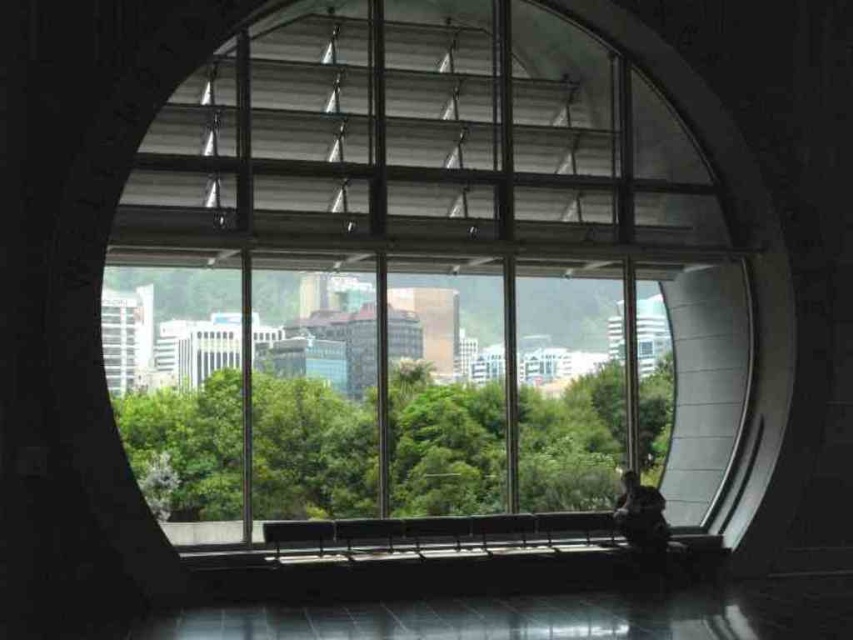
Question: Which of the following is the closest to the observer?

Choices:
 (A) transparent glass window at center
 (B) green leafy tree at center

Answer: (A)

Question: Is transparent glass window at center smaller than green leafy tree at center?

Choices:
 (A) no
 (B) yes

Answer: (A)

Question: Which point is closer to the camera?

Choices:
 (A) transparent glass window at center
 (B) green leafy tree at center

Answer: (A)

Question: From the image, what is the correct spatial relationship of transparent glass window at center in relation to green leafy tree at center?

Choices:
 (A) left
 (B) right

Answer: (B)

Question: From the image, what is the correct spatial relationship of transparent glass window at center in relation to green leafy tree at center?

Choices:
 (A) below
 (B) above

Answer: (B)